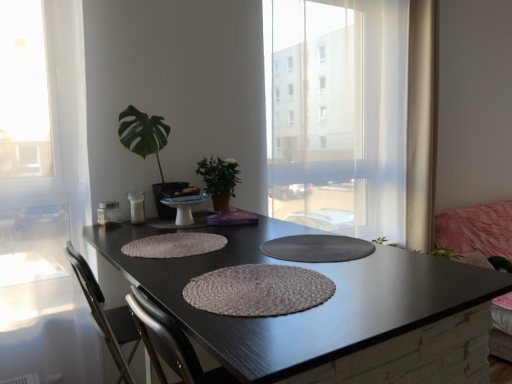
Locate an element on the screen. The height and width of the screenshot is (384, 512). vacant area that lies to the right of rustic woven placemat at center, the 1th wide in the front-to-back sequence is located at coordinates (391, 283).